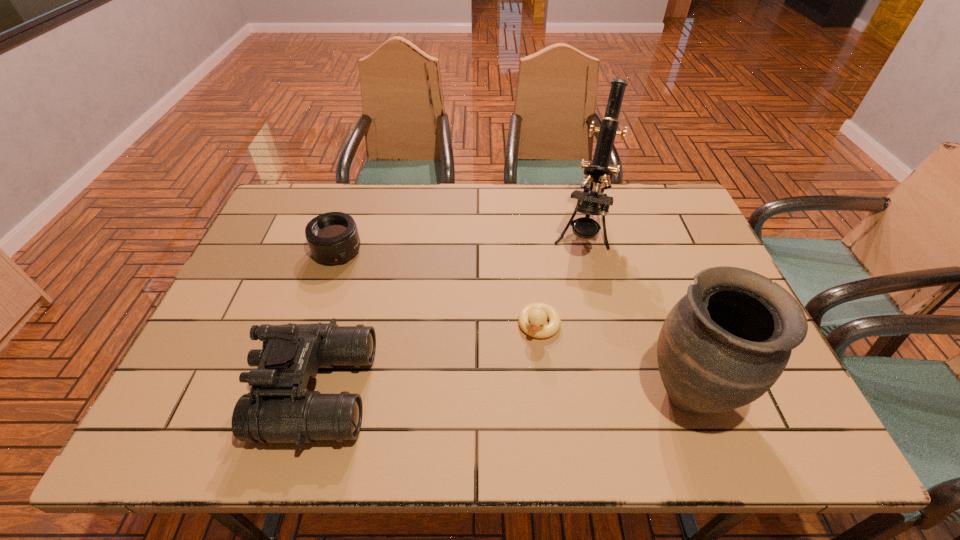
Locate an element on the screen. The height and width of the screenshot is (540, 960). free space located through the eyepiece of the microscope is located at coordinates (563, 328).

I want to click on vacant region located 0.060m through the eyepiece of the microscope, so click(576, 278).

Identify the location of free space located on the side of the telephoto lens with brand markings and control switches. point(414,330).

Where is `free space located on the side of the telephoto lens with brand markings and control switches`? This screenshot has height=540, width=960. free space located on the side of the telephoto lens with brand markings and control switches is located at coordinates (398, 314).

Image resolution: width=960 pixels, height=540 pixels. In order to click on vacant region located 0.280m on the side of the telephoto lens with brand markings and control switches in this screenshot , I will do `click(404, 321)`.

What are the coordinates of `vacant region located at the beak of the third object from right to left` in the screenshot? It's located at (517, 383).

The image size is (960, 540). I want to click on vacant space situated at the beak of the third object from right to left, so click(516, 387).

You are a GUI agent. You are given a task and a screenshot of the screen. Output one action in this format:
    pyautogui.click(x=<x>, y=<y>)
    Task: Click on the object at the far edge
    
    Given the screenshot: What is the action you would take?
    pyautogui.click(x=599, y=172)

I want to click on binoculars present at the near edge, so pyautogui.click(x=279, y=408).

You are a GUI agent. You are given a task and a screenshot of the screen. Output one action in this format:
    pyautogui.click(x=<x>, y=<y>)
    Task: Click on the urn positioned at the near edge
    
    Given the screenshot: What is the action you would take?
    pyautogui.click(x=724, y=344)